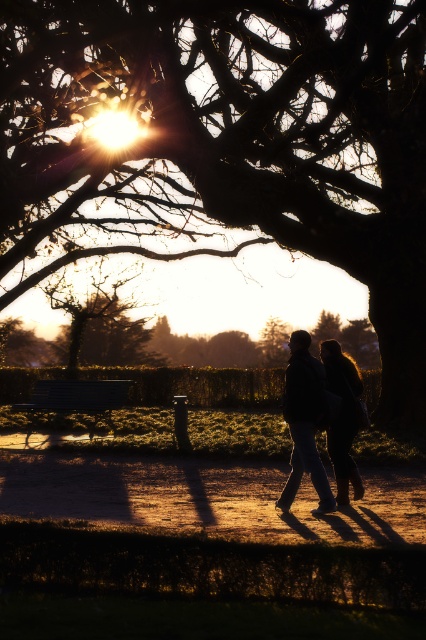
You are a photographer trying to capture the sunset in the park. You want to frame the brown textured tree at upper center and the metallic silver bench at lower left in your shot. Based on their positions, which object should you focus on first to ensure both are in the frame?

The brown textured tree at upper center is located above the metallic silver bench at lower left, so you should focus on the brown textured tree at upper center first to ensure both are in the frame.

From the picture: You are a photographer trying to capture the sunset in the park. You notice the silky black hair at center and the metallic silver bench at lower left. Which object would require a wider aperture setting to ensure sharp focus on the subject while blurring the background?

The silky black hair at center is smaller than the metallic silver bench at lower left. A wider aperture is needed for the smaller silky black hair at center to achieve a shallow depth of field, keeping it in focus while blurring the background.